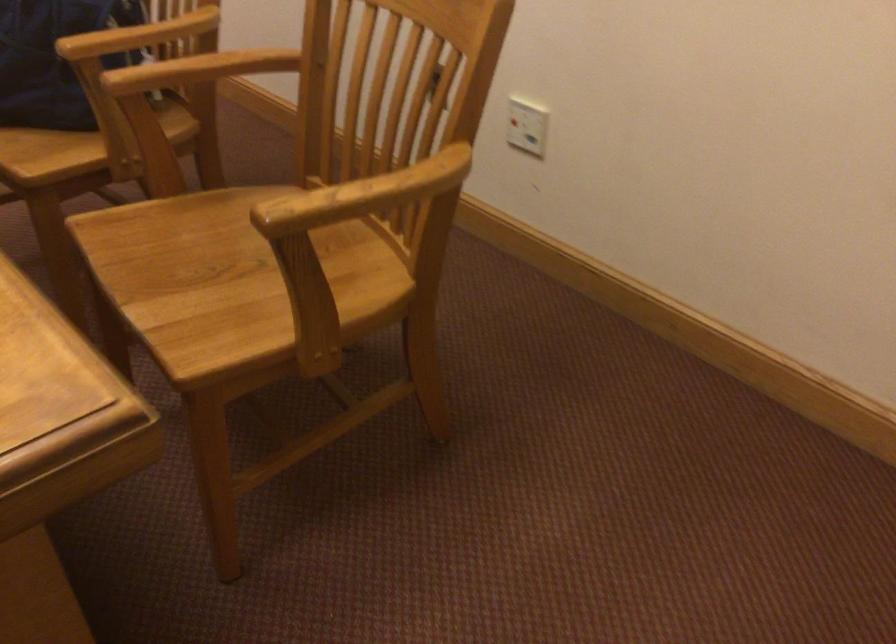
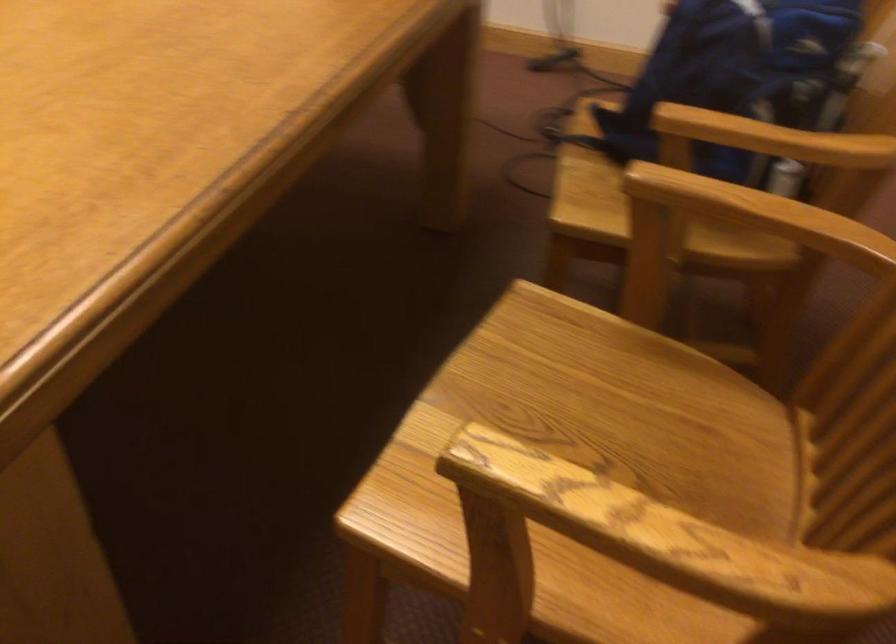
Where in the second image is the point corresponding to the point at 393,187 from the first image?

(658, 542)